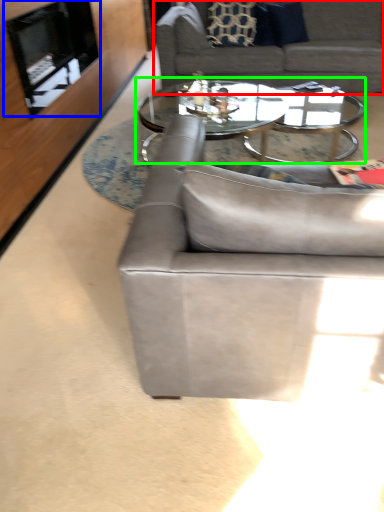
Question: Which is farther away from studio couch (highlighted by a red box)? fireplace (highlighted by a blue box) or coffee table (highlighted by a green box)?

Choices:
 (A) fireplace
 (B) coffee table

Answer: (A)